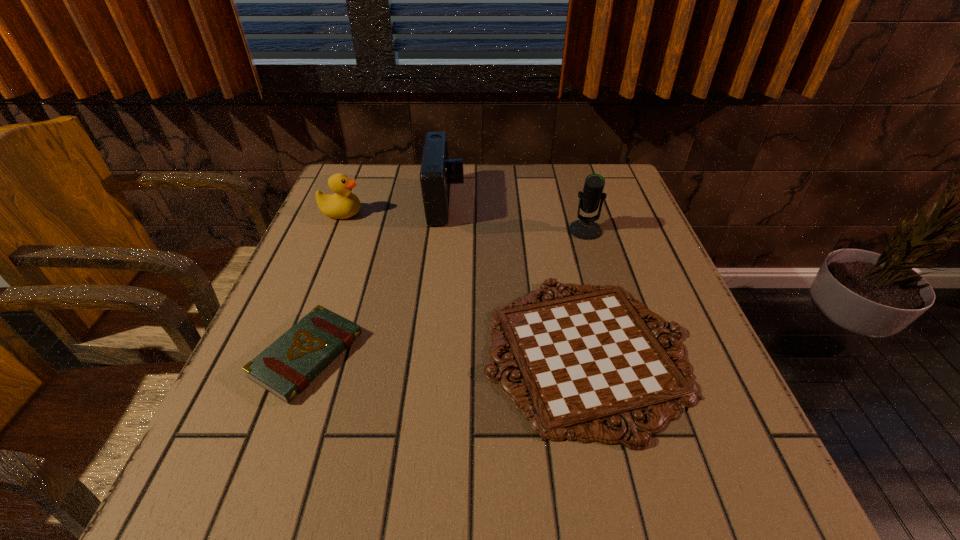
Locate an element on the screen. camera that is at the far edge is located at coordinates (437, 172).

Where is `duck that is at the far edge`? duck that is at the far edge is located at coordinates (343, 204).

Image resolution: width=960 pixels, height=540 pixels. Find the location of `duck that is at the left edge`. duck that is at the left edge is located at coordinates (343, 204).

Where is `book located in the left edge section of the desktop`? The image size is (960, 540). book located in the left edge section of the desktop is located at coordinates (285, 368).

Identify the location of microphone that is at the right edge. (585, 228).

The image size is (960, 540). Find the location of `chessboard located at the right edge`. chessboard located at the right edge is located at coordinates (586, 359).

In order to click on object that is positioned at the far left corner in this screenshot , I will do `click(343, 204)`.

In order to click on vacant space at the far edge of the desktop in this screenshot , I will do `click(481, 188)`.

At what (x,y) coordinates should I click in order to perform the action: click on free space at the near edge of the desktop. Please return your answer as a coordinate pair (x, y). Looking at the image, I should click on (398, 506).

Where is `free space at the left edge of the desktop`? This screenshot has width=960, height=540. free space at the left edge of the desktop is located at coordinates (217, 428).